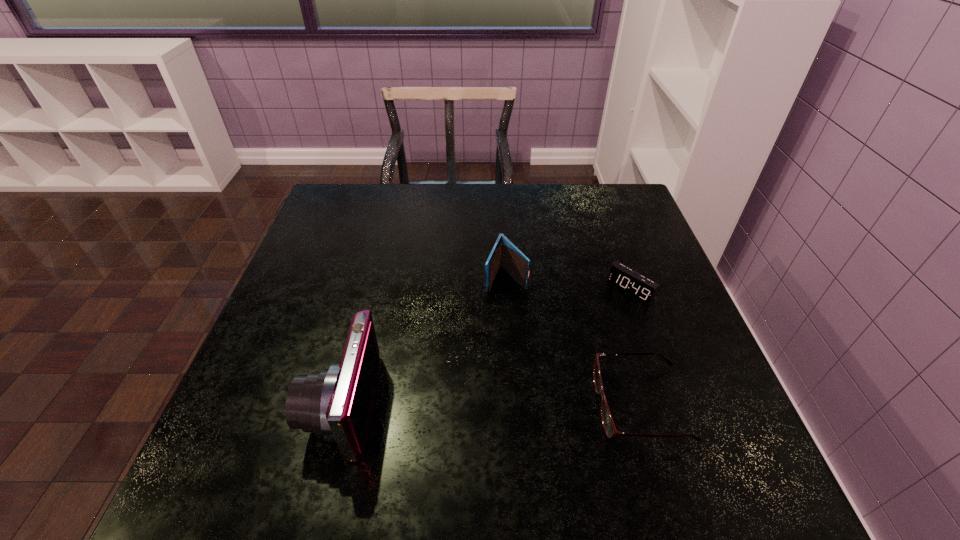
Identify the location of vacant space at the far right corner of the desktop. (620, 221).

The height and width of the screenshot is (540, 960). Find the location of `free space at the near right corner of the desktop`. free space at the near right corner of the desktop is located at coordinates (725, 416).

Image resolution: width=960 pixels, height=540 pixels. In order to click on free space between the shortest object and the wallet in this screenshot , I will do `click(573, 341)`.

The width and height of the screenshot is (960, 540). I want to click on empty space that is in between the third shortest object and the spectacles, so click(x=573, y=341).

You are a GUI agent. You are given a task and a screenshot of the screen. Output one action in this format:
    pyautogui.click(x=<x>, y=<y>)
    Task: Click on the free space that is in between the third object from right to left and the third tallest object
    The width and height of the screenshot is (960, 540).
    Given the screenshot: What is the action you would take?
    pyautogui.click(x=568, y=285)

This screenshot has width=960, height=540. I want to click on vacant area that lies between the third tallest object and the third shortest object, so click(x=568, y=285).

Where is `free area in between the shortest object and the second object from left to right`? free area in between the shortest object and the second object from left to right is located at coordinates (573, 341).

Locate an element on the screen. This screenshot has width=960, height=540. vacant area that lies between the camera and the third tallest object is located at coordinates pyautogui.click(x=488, y=348).

Image resolution: width=960 pixels, height=540 pixels. Identify the location of free space between the wallet and the second shortest object. (568, 285).

Identify the location of free spot between the third shortest object and the spectacles. (573, 341).